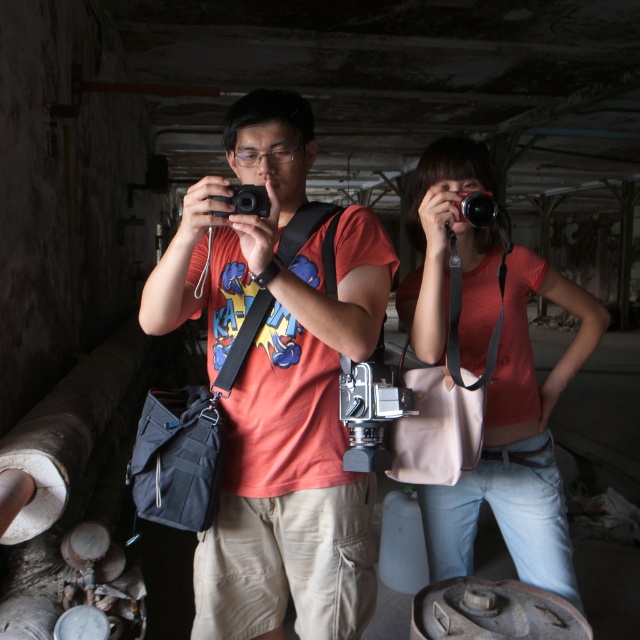
You are standing at point (196, 268) in the abandoned building. You want to take a photo of the camera. Is the camera within your reach to take a photo without moving from your current position?

The camera is 4.57 feet away from point (196, 268). Since the distance is more than an average person can reach, you would need to move closer to take the photo.

You are organizing a photoshoot in this abandoned building and need to decide which item to place in the foreground for better visibility. Given that the matte pink purse at center and the black plastic camera at center are both options, which one would you choose and why?

The matte pink purse at center is larger in size than the black plastic camera at center, so it would be more visible in the foreground, making it a better choice for the photoshoot.